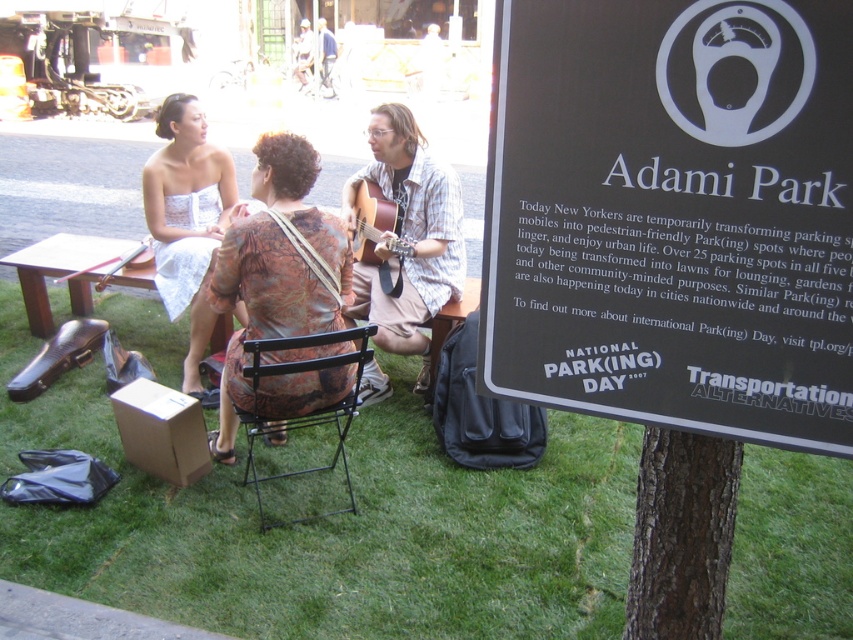
Question: Which object appears farthest from the camera in this image?

Choices:
 (A) green grass at lower center
 (B) wooden acoustic guitar at center
 (C) black plastic sign at upper right

Answer: (B)

Question: Based on their relative distances, which object is nearer to the green grass at lower center?

Choices:
 (A) black plastic sign at upper right
 (B) white lace dress at upper left
 (C) black metal folding chair at center

Answer: (C)

Question: Considering the relative positions of black plastic sign at upper right and green grass at lower center in the image provided, where is black plastic sign at upper right located with respect to green grass at lower center?

Choices:
 (A) right
 (B) left

Answer: (A)

Question: Is wooden acoustic guitar at center wider than black metal folding chair at center?

Choices:
 (A) yes
 (B) no

Answer: (B)

Question: Can you confirm if green grass at lower center is thinner than wooden acoustic guitar at center?

Choices:
 (A) no
 (B) yes

Answer: (A)

Question: Which object is the farthest from the brown rough bark tree at lower center?

Choices:
 (A) green grass at lower center
 (B) black metal folding chair at center

Answer: (B)